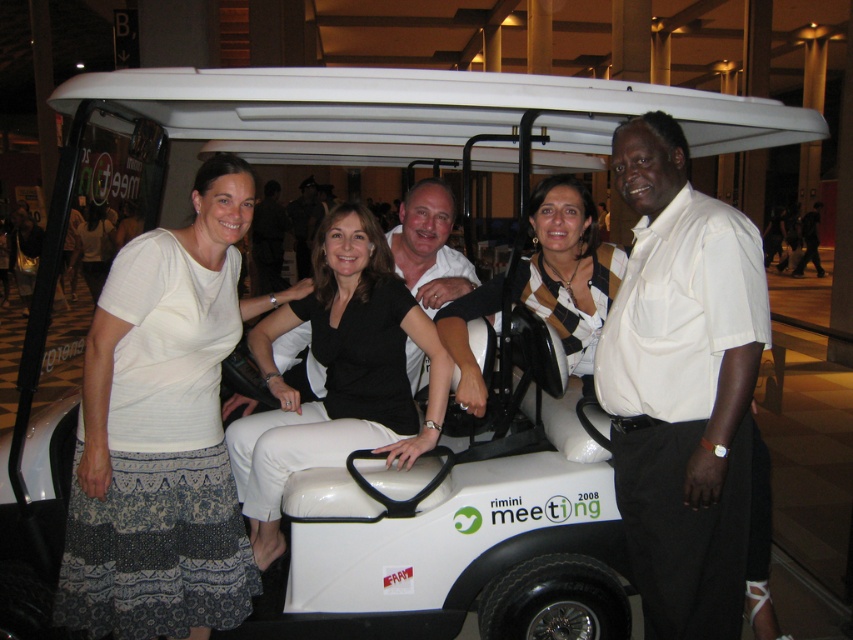
Question: Which object is farther from the camera taking this photo?

Choices:
 (A) black matte pants at center
 (B) white smooth golf cart at center
 (C) matte black shirt at center
 (D) white shirt at center

Answer: (C)

Question: Is the position of white textured skirt at lower left less distant than that of black and white striped shirt at center?

Choices:
 (A) yes
 (B) no

Answer: (A)

Question: Which point is closer to the camera?

Choices:
 (A) matte black shirt at center
 (B) black matte pants at center
 (C) white textured skirt at lower left

Answer: (C)

Question: Can you confirm if black matte pants at center is thinner than white smooth golf cart at center?

Choices:
 (A) yes
 (B) no

Answer: (B)

Question: Which object is positioned farthest from the black matte pants at center?

Choices:
 (A) white smooth golf cart at center
 (B) white textured skirt at lower left

Answer: (A)

Question: Is white shirt at center positioned in front of black matte pants at center?

Choices:
 (A) no
 (B) yes

Answer: (B)